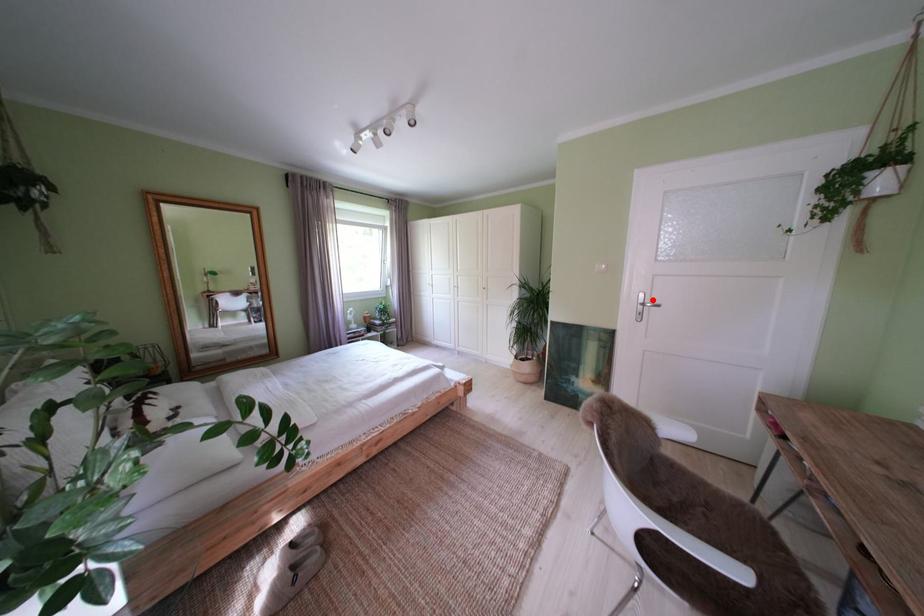
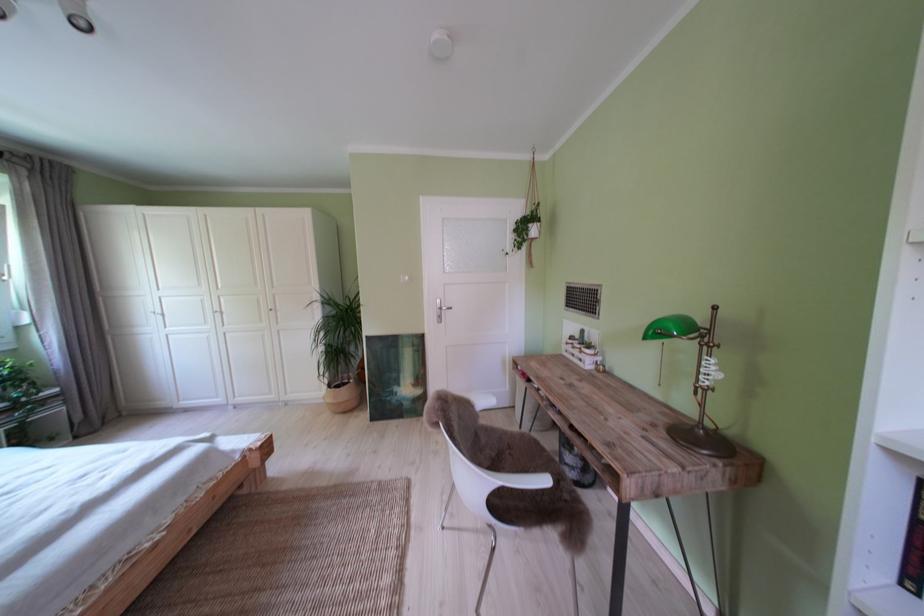
In the second image, find the point that corresponds to the highlighted location in the first image.

(450, 307)